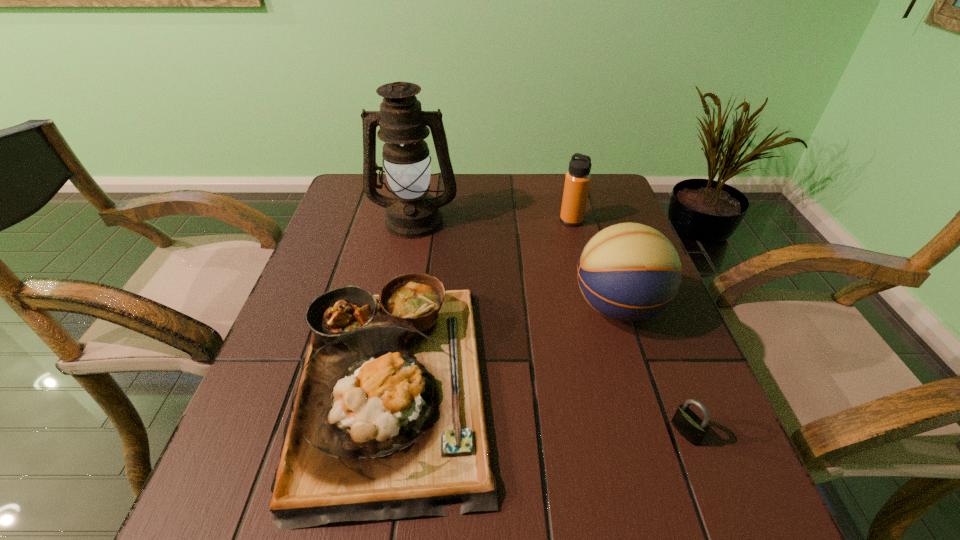
This screenshot has height=540, width=960. In order to click on object that is positioned at the far left corner in this screenshot , I will do `click(412, 213)`.

The image size is (960, 540). I want to click on object at the near left corner, so click(x=388, y=421).

Locate an element on the screen. Image resolution: width=960 pixels, height=540 pixels. object present at the far right corner is located at coordinates (577, 181).

Where is `blank area at the far edge`? This screenshot has width=960, height=540. blank area at the far edge is located at coordinates (431, 192).

Image resolution: width=960 pixels, height=540 pixels. Identify the location of vacant space at the left edge of the desktop. (363, 260).

The image size is (960, 540). I want to click on free space at the right edge of the desktop, so click(584, 227).

Image resolution: width=960 pixels, height=540 pixels. What are the coordinates of `free space at the far left corner of the desktop` in the screenshot? It's located at (351, 207).

The height and width of the screenshot is (540, 960). In order to click on vacant space at the near right corner of the desktop in this screenshot , I will do `click(718, 529)`.

This screenshot has height=540, width=960. What are the coordinates of `vacant area between the thermos bottle and the padlock` in the screenshot? It's located at (629, 326).

Where is `vacant space that's between the padlock and the platter`? This screenshot has width=960, height=540. vacant space that's between the padlock and the platter is located at coordinates (539, 407).